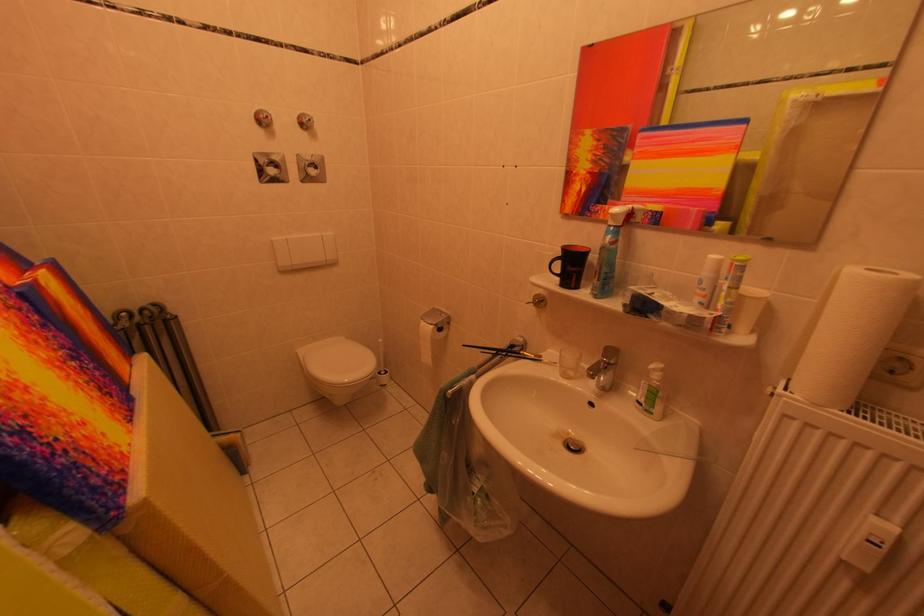
The height and width of the screenshot is (616, 924). What are the coordinates of `white toilet lid` in the screenshot? It's located at (336, 361).